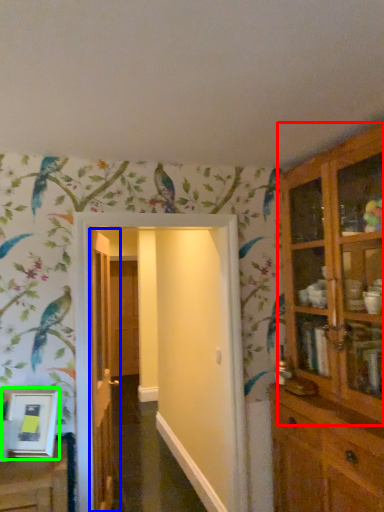
Question: Which object is positioned farthest from cupboard (highlighted by a red box)? Select from door (highlighted by a blue box) and picture frame (highlighted by a green box).

Choices:
 (A) door
 (B) picture frame

Answer: (B)